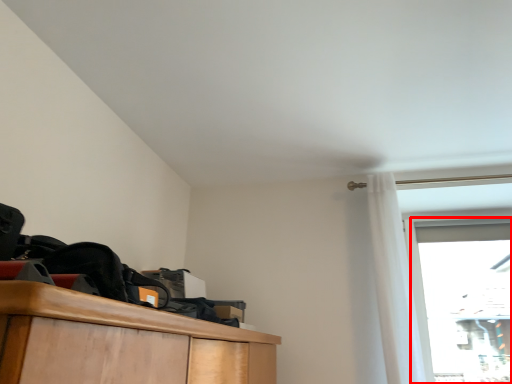
Question: In this image, where is glass door (annotated by the red box) located relative to curtain?

Choices:
 (A) left
 (B) right

Answer: (B)